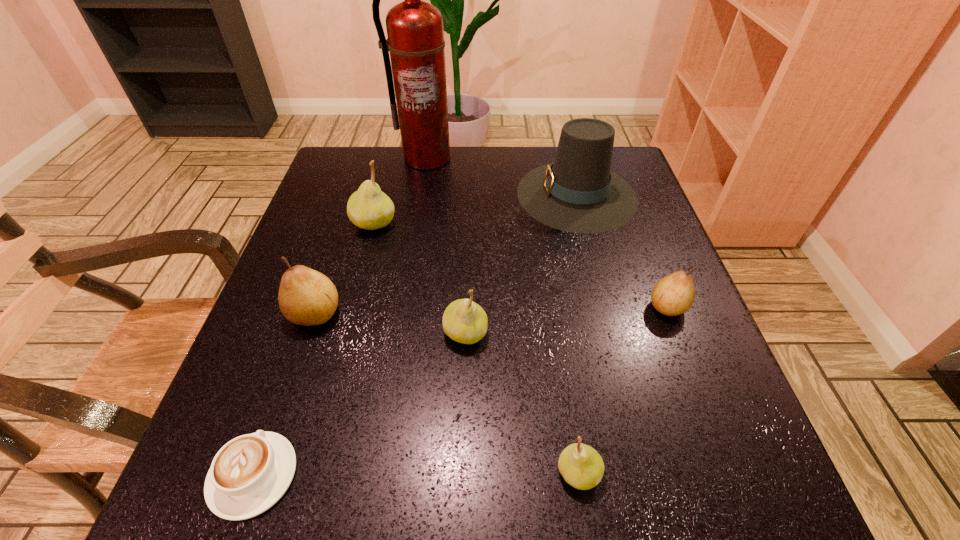
In the image, there is a desktop. Identify the location of vacant region at the near right corner. (685, 518).

Image resolution: width=960 pixels, height=540 pixels. What are the coordinates of `vacant space in between the red fire extinguisher and the gray hat` in the screenshot? It's located at (501, 176).

I want to click on vacant space in between the shortest object and the third pear from right to left, so click(359, 404).

Find the location of a particular element. This screenshot has width=960, height=540. empty space that is in between the left brown pear and the biggest green pear is located at coordinates (345, 268).

The width and height of the screenshot is (960, 540). Identify the location of free spot between the nearest pear and the smaller brown pear. (623, 390).

Where is `free space between the right brown pear and the second biggest green pear`? The image size is (960, 540). free space between the right brown pear and the second biggest green pear is located at coordinates (566, 320).

This screenshot has width=960, height=540. Identify the location of vacant space in between the farthest pear and the bigger brown pear. (345, 268).

Locate an element on the screen. free area in between the cappuccino and the leftmost green pear is located at coordinates (314, 349).

At what (x,y) coordinates should I click in order to perform the action: click on free space between the farthest green pear and the cappuccino. Please return your answer as a coordinate pair (x, y). This screenshot has width=960, height=540. Looking at the image, I should click on (314, 349).

Identify the location of empty space that is in between the third pear from right to left and the hat. The height and width of the screenshot is (540, 960). (521, 264).